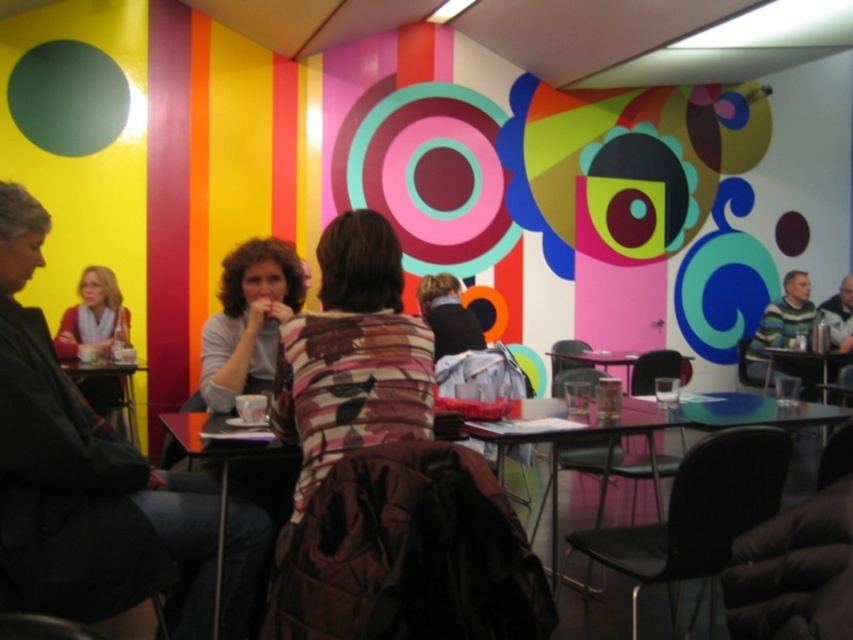
Between white sweater at left and wooden table at left, which one is positioned higher?

Positioned higher is white sweater at left.

Who is taller, white sweater at left or wooden table at left?

With more height is white sweater at left.

This screenshot has width=853, height=640. Find the location of `white sweater at left`. white sweater at left is located at coordinates (93, 316).

What do you see at coordinates (650, 432) in the screenshot? This screenshot has height=640, width=853. I see `matte black table at center` at bounding box center [650, 432].

Is the position of matte black table at center less distant than that of white sweater at left?

Yes, it is.

The height and width of the screenshot is (640, 853). Describe the element at coordinates (650, 432) in the screenshot. I see `matte black table at center` at that location.

You are a GUI agent. You are given a task and a screenshot of the screen. Output one action in this format:
    pyautogui.click(x=<x>, y=<y>)
    Task: Click on the matte black table at center
    The width and height of the screenshot is (853, 640).
    Given the screenshot: What is the action you would take?
    pyautogui.click(x=650, y=432)

Who is more forward, (x=125, y=406) or (x=785, y=353)?

Point (x=125, y=406)

Describe the element at coordinates (119, 385) in the screenshot. I see `wooden table at left` at that location.

Find the location of a particular element. wooden table at left is located at coordinates (119, 385).

Where is `wooden table at left`? wooden table at left is located at coordinates (119, 385).